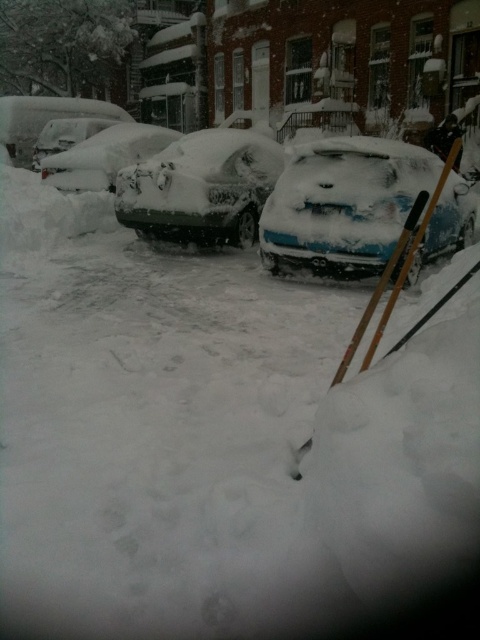
Describe the element at coordinates (343, 205) in the screenshot. I see `blue matte car at center` at that location.

Which of these two, blue matte car at center or snow-covered sedan at center, stands taller?

With more height is blue matte car at center.

This screenshot has height=640, width=480. Describe the element at coordinates (343, 205) in the screenshot. I see `blue matte car at center` at that location.

You are a GUI agent. You are given a task and a screenshot of the screen. Output one action in this format:
    pyautogui.click(x=<x>, y=<y>)
    Task: Click on the blue matte car at center
    The height and width of the screenshot is (640, 480).
    Given the screenshot: What is the action you would take?
    pyautogui.click(x=343, y=205)

Is the position of blue matte car at center more distant than that of snow-covered car at center?

No, blue matte car at center is closer to the viewer.

Identify the location of blue matte car at center. (343, 205).

Is snow-covered car at center to the right of white matte car at left from the viewer's perspective?

Indeed, snow-covered car at center is positioned on the right side of white matte car at left.

You are a GUI agent. You are given a task and a screenshot of the screen. Output one action in this format:
    pyautogui.click(x=<x>, y=<y>)
    Task: Click on the snow-covered car at center
    
    Given the screenshot: What is the action you would take?
    pyautogui.click(x=201, y=188)

Locate an element on the screen. snow-covered car at center is located at coordinates (201, 188).